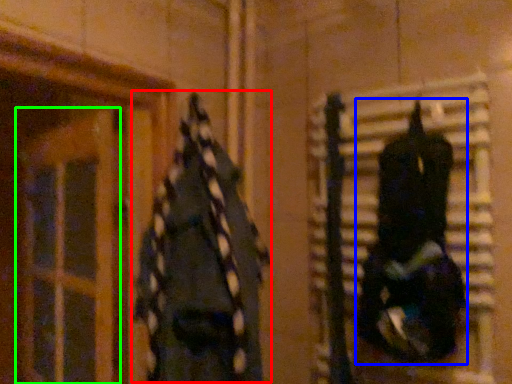
Question: Which is nearer to the clothing (highlighted by a red box)? clothing (highlighted by a blue box) or glass door (highlighted by a green box).

Choices:
 (A) clothing
 (B) glass door

Answer: (B)